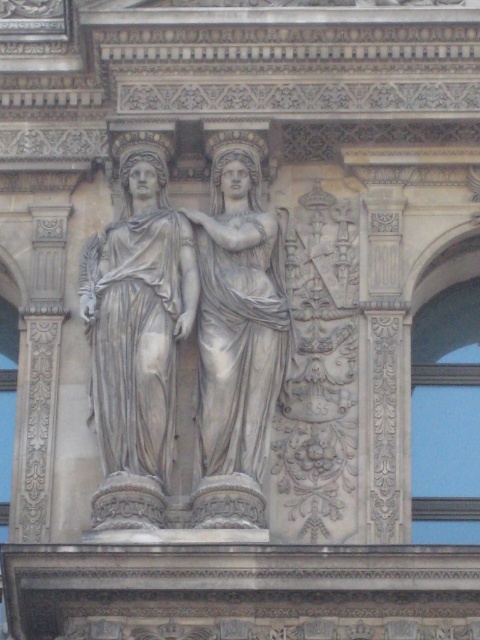
You are an art conservator examining the architectural relief sculpture. You notice two central statues, the gray marble statue at center and the white marble statue at center. Which one is positioned lower in the relief?

The gray marble statue at center is positioned below the white marble statue at center, so it is lower in the relief.

You are an art conservator working on a restoration project of the architectural relief sculpture. You need to place a protective barrier between the gray marble statue at center and the white marble statue at center. The barrier must be exactly 5 feet wide. Will the barrier fit between them without overlapping either statue?

The distance between the gray marble statue at center and the white marble statue at center is 5.54 feet. Since the barrier is 5 feet wide, it will fit between them with 0.54 feet of space remaining on either side, so yes, the barrier can be placed without overlapping.

You are an architect examining the relief sculpture. You need to locate the central figure precisely. Which object is positioned at the coordinate point (137, 320)?

The gray marble statue at center is positioned at the coordinate point (137, 320).